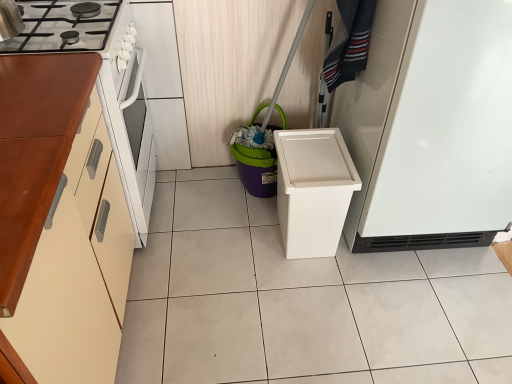
Image resolution: width=512 pixels, height=384 pixels. Find the location of `vacant space situated on the left part of purple plastic bucket at center`. vacant space situated on the left part of purple plastic bucket at center is located at coordinates (205, 190).